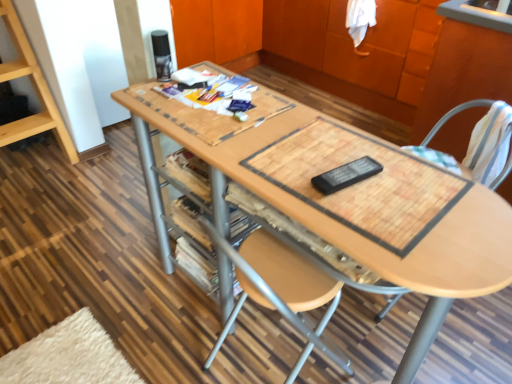
Locate an element on the screen. The width and height of the screenshot is (512, 384). free point above wooden table at center (from a real-world perspective) is located at coordinates (298, 151).